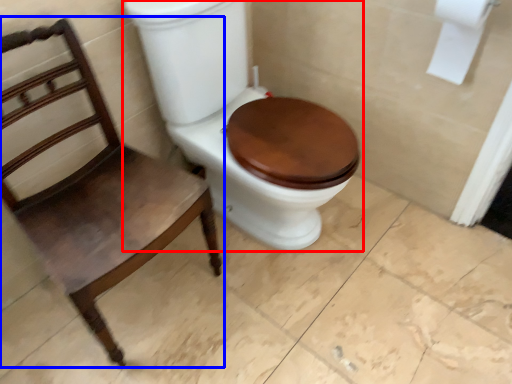
Question: Which point is closer to the camera, toilet (highlighted by a red box) or chair (highlighted by a blue box)?

Choices:
 (A) toilet
 (B) chair

Answer: (B)